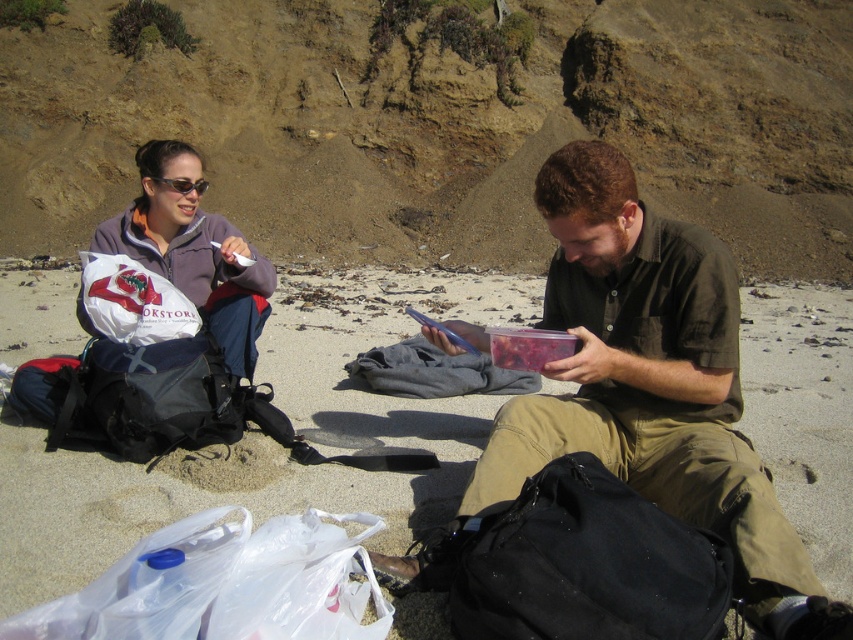
Measure the distance between matte green shirt at center and camera.

2.00 meters

Can you confirm if matte green shirt at center is shorter than matte black sunglasses at upper left?

Incorrect, matte green shirt at center's height does not fall short of matte black sunglasses at upper left's.

Which is behind, point (461, 541) or point (181, 180)?

The point (181, 180) is more distant.

Identify the location of matte green shirt at center. (642, 390).

From the picture: Is the position of matte purple jacket at upper left more distant than that of matte black sunglasses at upper left?

No, matte purple jacket at upper left is in front of matte black sunglasses at upper left.

Which is above, matte purple jacket at upper left or matte black sunglasses at upper left?

matte black sunglasses at upper left is higher up.

The width and height of the screenshot is (853, 640). Identify the location of matte purple jacket at upper left. (193, 252).

Is brown dirt hillside at upper center to the right of matte green shirt at center from the viewer's perspective?

Correct, you'll find brown dirt hillside at upper center to the right of matte green shirt at center.

Does brown dirt hillside at upper center lie behind matte green shirt at center?

Yes, it is behind matte green shirt at center.

The height and width of the screenshot is (640, 853). What do you see at coordinates (442, 122) in the screenshot? I see `brown dirt hillside at upper center` at bounding box center [442, 122].

Find the location of `brown dirt hillside at upper center`. brown dirt hillside at upper center is located at coordinates [x=442, y=122].